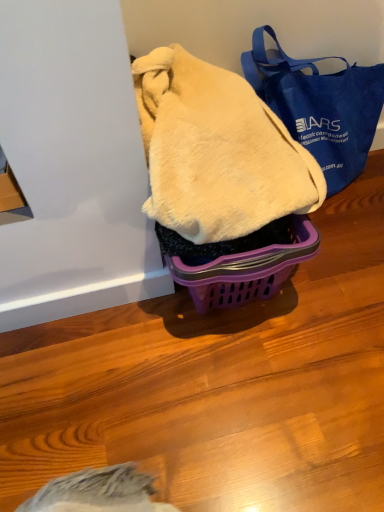
Question: Should I look upward or downward to see blue canvas tote bag at upper right?

Choices:
 (A) up
 (B) down

Answer: (A)